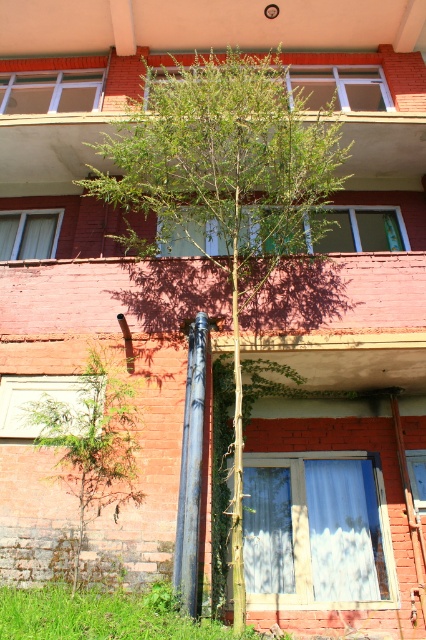
Question: Is the position of green leafy tree at lower left more distant than that of rusty metal pipe at center?

Choices:
 (A) no
 (B) yes

Answer: (B)

Question: Estimate the real-world distances between objects in this image. Which object is closer to the rusty metal pipe at center?

Choices:
 (A) green leafy tree at lower left
 (B) green leafy tree at center

Answer: (A)

Question: Which point is farther to the camera?

Choices:
 (A) (210, 134)
 (B) (189, 531)
 (C) (104, 429)

Answer: (A)

Question: Is green leafy tree at lower left to the right of rusty metal pipe at center from the viewer's perspective?

Choices:
 (A) yes
 (B) no

Answer: (B)

Question: Can you confirm if green leafy tree at center is positioned above rusty metal pipe at center?

Choices:
 (A) yes
 (B) no

Answer: (A)

Question: Which point is farther to the camera?

Choices:
 (A) (198, 376)
 (B) (235, 54)
 (C) (124, 458)

Answer: (B)